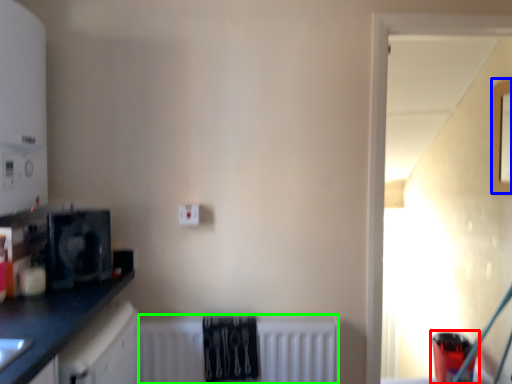
Question: Which is nearer to the appliance (highlighted by a red box)? window (highlighted by a blue box) or radiator (highlighted by a green box).

Choices:
 (A) window
 (B) radiator

Answer: (A)